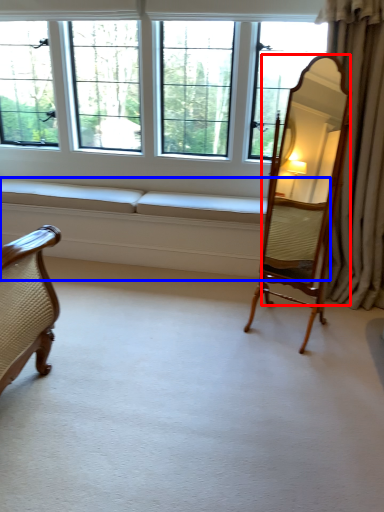
Question: Among these objects, which one is farthest to the camera, mirror (highlighted by a red box) or couch (highlighted by a blue box)?

Choices:
 (A) mirror
 (B) couch

Answer: (B)